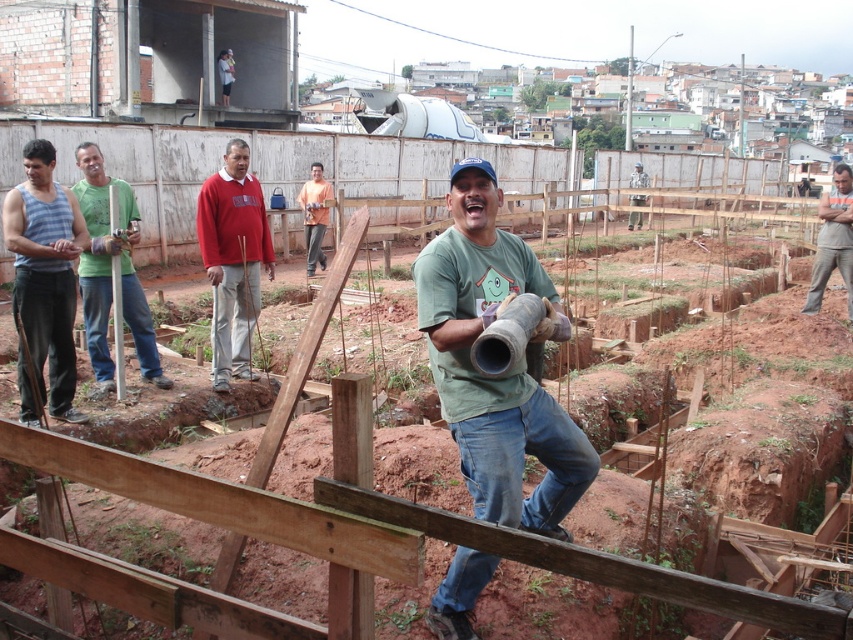
Measure the distance from red sweater at center to brown cotton pants at center.

21.90 feet

Who is more forward, [207,182] or [825,205]?

Point [207,182] is in front.

Locate an element on the screen. The width and height of the screenshot is (853, 640). red sweater at center is located at coordinates (233, 260).

Does striped tank top at left have a lesser width compared to camouflage fabric shirt at center?

Yes.

Does striped tank top at left have a greater width compared to camouflage fabric shirt at center?

No, striped tank top at left is not wider than camouflage fabric shirt at center.

Image resolution: width=853 pixels, height=640 pixels. In order to click on striped tank top at left in this screenshot , I will do `click(44, 280)`.

The width and height of the screenshot is (853, 640). I want to click on green matte shirt at center, so click(x=498, y=376).

This screenshot has width=853, height=640. What do you see at coordinates (498, 376) in the screenshot? I see `green matte shirt at center` at bounding box center [498, 376].

You are a GUI agent. You are given a task and a screenshot of the screen. Output one action in this format:
    pyautogui.click(x=<x>, y=<y>)
    Task: Click on the green matte shirt at center
    This screenshot has width=853, height=640.
    Given the screenshot: What is the action you would take?
    pyautogui.click(x=498, y=376)